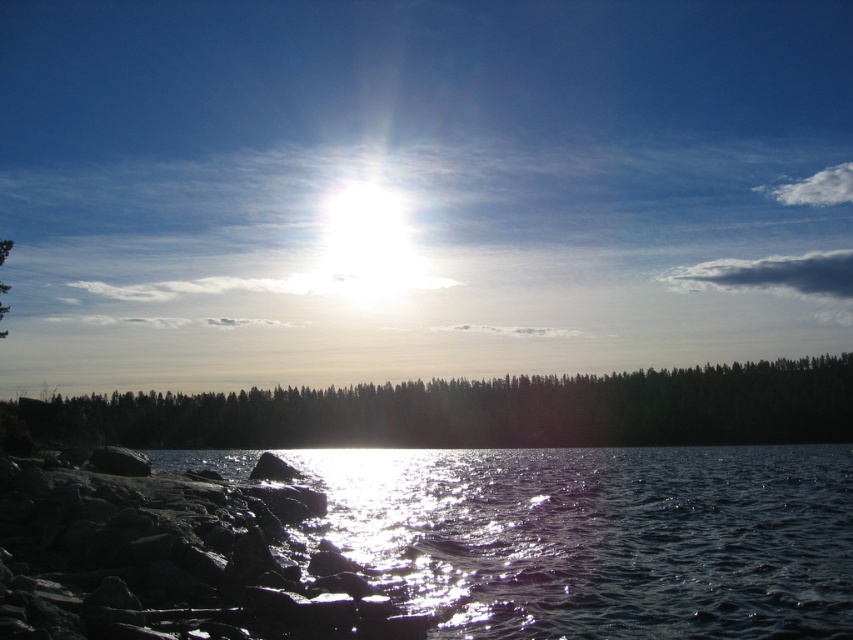
You are standing on the lakeside and want to take a photo of the dark green forest at center and the green matte tree at left. Which object should you point your camera towards first if you want to capture both in one shot?

You should point your camera towards the green matte tree at left first because the dark green forest at center is located below it, so adjusting the angle to include both would require framing from the tree downward to the forest.

You are a photographer standing at the lakeside. You want to capture a photo of the smooth gray rock at lower left and the glistening water at lower left. Based on their positions, which object will appear closer to the camera in the photo?

The glistening water at lower left will appear closer to the camera in the photo because the smooth gray rock at lower left is behind it.

You are standing on the lakeside and see the glistening water at lower left and the smooth gray rock at lower left. Which object is closer to the water surface?

The glistening water at lower left is below the smooth gray rock at lower left, so the glistening water at lower left is closer to the water surface.